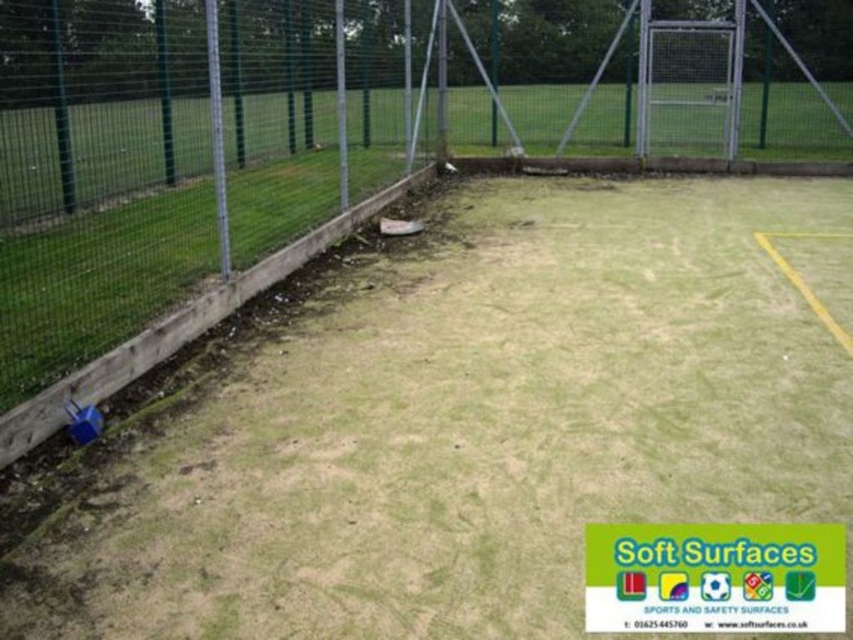
You are a groundskeeper inspecting the sports field. You see the green grass at center and the green wire mesh fence at upper left. Which object is positioned to the right side of the other?

The green grass at center is to the right of the green wire mesh fence at upper left.

In the scene shown: You are standing at the center of the sports field and want to pick up an object. You see two points marked on the field, point 1 at coordinates point (207, 534) and point 2 at coordinates point (390, 184). Which point is closer to you?

Point (207, 534) is closer to the camera than point (390, 184), so you should go to point (207, 534) first.